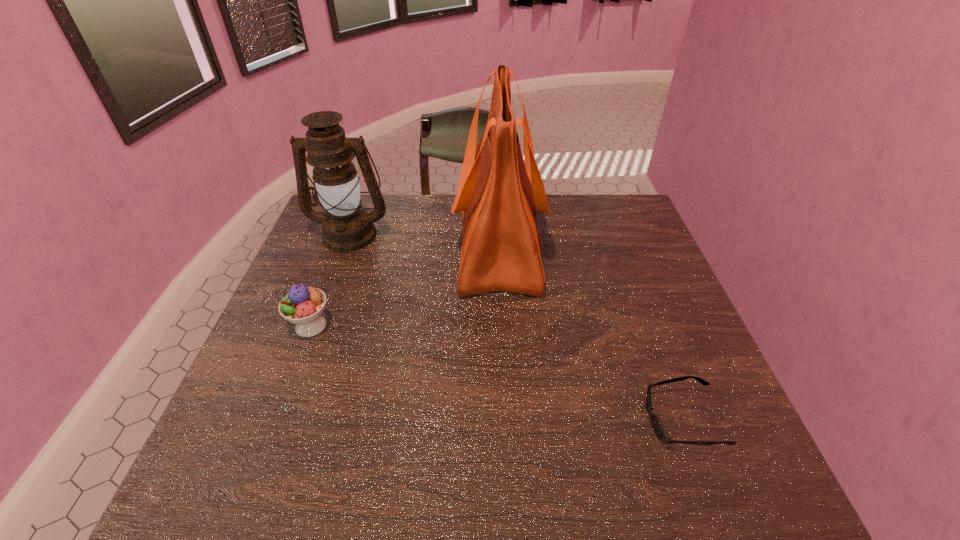
You are a GUI agent. You are given a task and a screenshot of the screen. Output one action in this format:
    pyautogui.click(x=<x>, y=<y>)
    Task: Click on the tallest object
    The height and width of the screenshot is (540, 960).
    Given the screenshot: What is the action you would take?
    pyautogui.click(x=498, y=194)

You are a GUI agent. You are given a task and a screenshot of the screen. Output one action in this format:
    pyautogui.click(x=<x>, y=<y>)
    Task: Click on the second object from right to left
    
    Given the screenshot: What is the action you would take?
    pyautogui.click(x=498, y=194)

Locate an element on the screen. This screenshot has width=960, height=540. oil lamp is located at coordinates click(346, 228).

The height and width of the screenshot is (540, 960). I want to click on the third farthest object, so click(x=303, y=306).

Where is `icecream`? icecream is located at coordinates (303, 306).

Find the location of a particular element. This screenshot has height=540, width=960. the shortest object is located at coordinates (657, 427).

This screenshot has width=960, height=540. I want to click on the rightmost object, so click(x=657, y=427).

Locate an element on the screen. vacant space situated 0.180m on the front pocket of the shopping bag is located at coordinates (395, 244).

In order to click on vacant region located on the front pocket of the shopping bag in this screenshot , I will do `click(415, 244)`.

The width and height of the screenshot is (960, 540). In order to click on free space located on the front pocket of the shopping bag in this screenshot , I will do `click(431, 244)`.